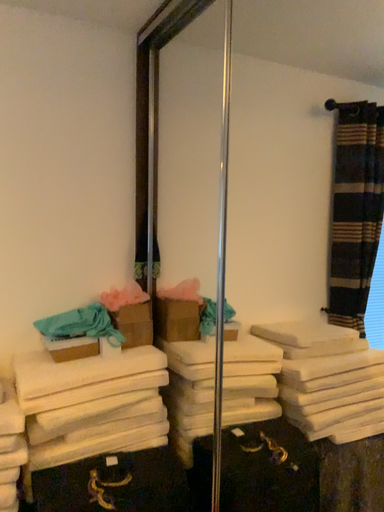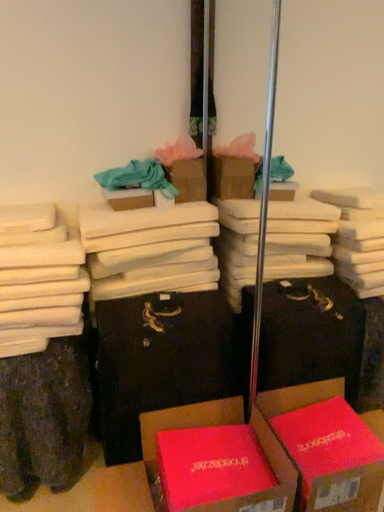
Question: Which way did the camera rotate in the video?

Choices:
 (A) rotated upward
 (B) rotated downward

Answer: (B)